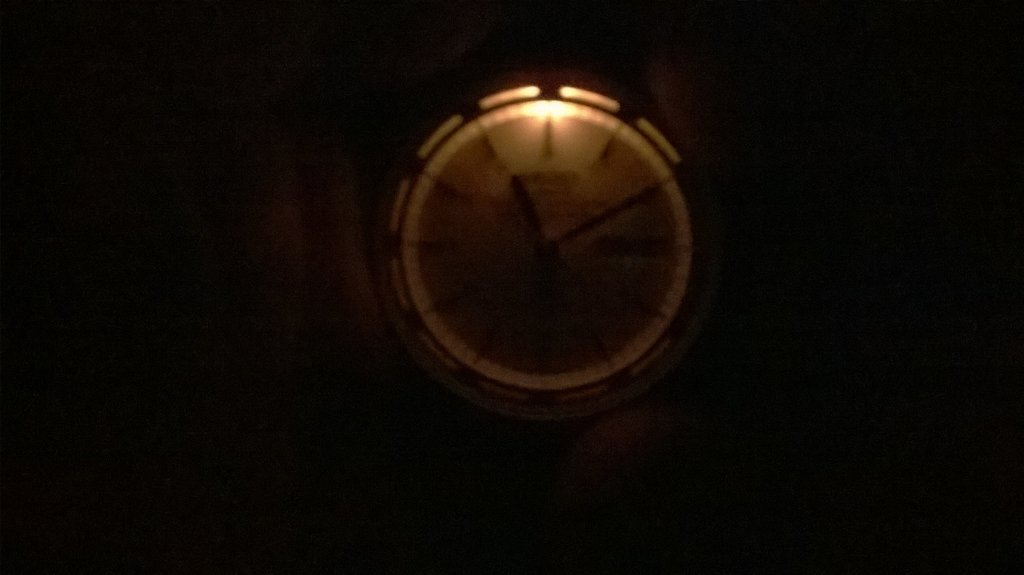
The height and width of the screenshot is (575, 1024). In order to click on light grooves in this screenshot , I will do `click(502, 103)`, `click(593, 99)`, `click(660, 145)`, `click(650, 361)`, `click(600, 391)`, `click(513, 396)`, `click(442, 361)`, `click(400, 293)`, `click(396, 221)`, `click(436, 145)`.